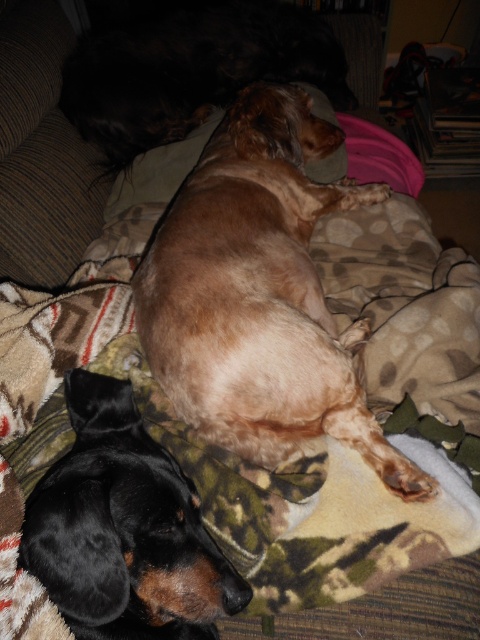
Can you confirm if light brown fur at center is smaller than black smooth dog at lower left?

No.

Between point (256, 90) and point (27, 522), which one is positioned behind?

Positioned behind is point (256, 90).

Between point (218, 177) and point (24, 520), which one is positioned in front?

Point (24, 520)

At what (x,y) coordinates should I click in order to perform the action: click on light brown fur at center. Please return your answer as a coordinate pair (x, y). The width and height of the screenshot is (480, 640). Looking at the image, I should click on coord(260,294).

Can you confirm if black smooth dog at lower left is wider than brown fur dog at upper center?

No.

Is point (117, 600) positioned before point (220, 60)?

Yes, it is.

Find the location of a particular element. Image resolution: width=480 pixels, height=640 pixels. black smooth dog at lower left is located at coordinates (123, 529).

You are a GUI agent. You are given a task and a screenshot of the screen. Output one action in this format:
    pyautogui.click(x=<x>, y=<y>)
    Task: Click on the black smooth dog at lower left
    
    Given the screenshot: What is the action you would take?
    pyautogui.click(x=123, y=529)

In the scene shown: Is light brown fur at center in front of brown fur dog at upper center?

That is True.

Who is taller, light brown fur at center or brown fur dog at upper center?

Standing taller between the two is light brown fur at center.

Does point (264, 129) lie in front of point (305, 33)?

Yes, it is.

Find the location of a particular element. Image resolution: width=480 pixels, height=640 pixels. light brown fur at center is located at coordinates (260, 294).